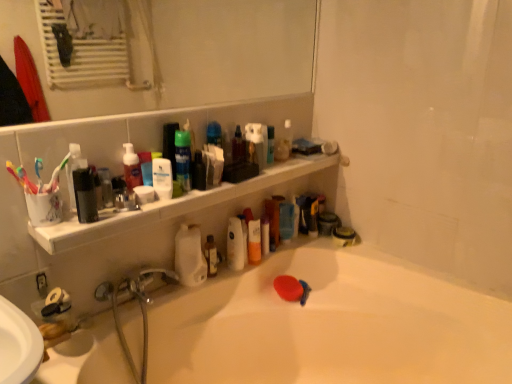
This screenshot has height=384, width=512. I want to click on unoccupied area in front of matte black bottle at upper left, marked as the second mouthwash in a front-to-back arrangement, so click(89, 227).